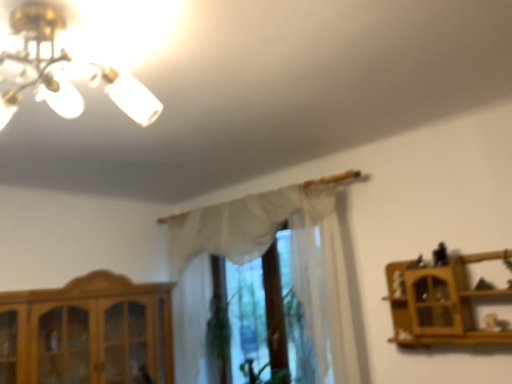
The image size is (512, 384). What do you see at coordinates (243, 224) in the screenshot?
I see `white sheer curtain at center` at bounding box center [243, 224].

The height and width of the screenshot is (384, 512). I want to click on wooden shelf at right, so [440, 302].

Does black plastic toy at upper right have a greater width compared to white sheer curtain at center?

Incorrect, the width of black plastic toy at upper right does not surpass that of white sheer curtain at center.

Considering the relative sizes of black plastic toy at upper right and white sheer curtain at center in the image provided, is black plastic toy at upper right shorter than white sheer curtain at center?

Correct, black plastic toy at upper right is not as tall as white sheer curtain at center.

From a real-world perspective, is black plastic toy at upper right under white sheer curtain at center?

Correct, in the physical world, black plastic toy at upper right is lower than white sheer curtain at center.

Where is `shelf that appears on the right of black plastic toy at upper right`? The height and width of the screenshot is (384, 512). shelf that appears on the right of black plastic toy at upper right is located at coordinates (440, 302).

In the scene shown: How distant is wooden shelf at right from black plastic toy at upper right?

The distance of wooden shelf at right from black plastic toy at upper right is 9.78 inches.

From the image's perspective, is wooden shelf at right located beneath black plastic toy at upper right?

Yes, from the image's perspective, wooden shelf at right is beneath black plastic toy at upper right.

Is wooden shelf at right oriented towards black plastic toy at upper right?

No.

From a real-world perspective, is wooden cabinet at lower left positioned above or below white sheer curtain at center?

From a real-world perspective, wooden cabinet at lower left is physically below white sheer curtain at center.

In the image, is wooden cabinet at lower left on the left side or the right side of white sheer curtain at center?

wooden cabinet at lower left is positioned on white sheer curtain at center's left side.

Are wooden cabinet at lower left and white sheer curtain at center located far from each other?

No, wooden cabinet at lower left is in close proximity to white sheer curtain at center.

Could you tell me if wooden cabinet at lower left is facing white sheer curtain at center?

Yes, wooden cabinet at lower left is turned towards white sheer curtain at center.

You are a GUI agent. You are given a task and a screenshot of the screen. Output one action in this format:
    pyautogui.click(x=<x>, y=<y>)
    Task: Click on the curtain that appears below the black plastic toy at upper right (from the image's perspective)
    The image size is (512, 384).
    Given the screenshot: What is the action you would take?
    pyautogui.click(x=243, y=224)

Considering the sizes of white sheer curtain at center and black plastic toy at upper right in the image, is white sheer curtain at center wider or thinner than black plastic toy at upper right?

Considering their sizes, white sheer curtain at center looks broader than black plastic toy at upper right.

Between white sheer curtain at center and black plastic toy at upper right, which one has less height?

With less height is black plastic toy at upper right.

Does white sheer curtain at center appear on the left side of black plastic toy at upper right?

Yes, white sheer curtain at center is to the left of black plastic toy at upper right.

Is wooden shelf at right aimed at wooden cabinet at lower left?

No, wooden shelf at right does not turn towards wooden cabinet at lower left.

From the image's perspective, is wooden shelf at right above wooden cabinet at lower left?

Yes, from the image's perspective, wooden shelf at right is on top of wooden cabinet at lower left.

Between wooden shelf at right and wooden cabinet at lower left, which one has smaller size?

With smaller size is wooden shelf at right.

Can you confirm if wooden shelf at right is positioned to the right of wooden cabinet at lower left?

Correct, you'll find wooden shelf at right to the right of wooden cabinet at lower left.

Is black plastic toy at upper right completely or partially outside of wooden shelf at right?

No, black plastic toy at upper right is not entirely external to wooden shelf at right.

Which of these two, black plastic toy at upper right or wooden shelf at right, stands taller?

Standing taller between the two is wooden shelf at right.

From the image's perspective, is black plastic toy at upper right above or below wooden shelf at right?

black plastic toy at upper right is above wooden shelf at right.

Which object is closer to the camera taking this photo, black plastic toy at upper right or wooden shelf at right?

wooden shelf at right is closer to the camera.

How much distance is there between white sheer curtain at center and wooden cabinet at lower left?

The distance of white sheer curtain at center from wooden cabinet at lower left is 32.98 inches.

Is wooden cabinet at lower left surrounded by white sheer curtain at center?

Definitely not — wooden cabinet at lower left is not inside white sheer curtain at center.

Based on the photo, from the image's perspective, is white sheer curtain at center below wooden cabinet at lower left?

No, from the image's perspective, white sheer curtain at center is not below wooden cabinet at lower left.

Looking at this image, which object is thinner, white sheer curtain at center or wooden cabinet at lower left?

white sheer curtain at center.

Image resolution: width=512 pixels, height=384 pixels. I want to click on toy that appears above the white sheer curtain at center (from the image's perspective), so click(x=440, y=255).

At what (x,y) coordinates should I click in order to perform the action: click on shelf located in front of the black plastic toy at upper right. Please return your answer as a coordinate pair (x, y). The width and height of the screenshot is (512, 384). Looking at the image, I should click on (440, 302).

When comparing their distances from wooden shelf at right, does wooden cabinet at lower left or black plastic toy at upper right seem further?

Based on the image, wooden cabinet at lower left appears to be further to wooden shelf at right.

Which object lies further to the anchor point white sheer curtain at center, wooden cabinet at lower left or wooden shelf at right?

The object further to white sheer curtain at center is wooden shelf at right.

When comparing their distances from wooden cabinet at lower left, does white sheer curtain at center or black plastic toy at upper right seem closer?

white sheer curtain at center.

When comparing their distances from wooden cabinet at lower left, does black plastic toy at upper right or white sheer curtain at center seem closer?

Among the two, white sheer curtain at center is located nearer to wooden cabinet at lower left.

When comparing their distances from black plastic toy at upper right, does wooden shelf at right or white sheer curtain at center seem closer?

Based on the image, wooden shelf at right appears to be nearer to black plastic toy at upper right.

Which object lies further to the anchor point black plastic toy at upper right, wooden shelf at right or wooden cabinet at lower left?

wooden cabinet at lower left.

From the image, which object appears to be farther from white sheer curtain at center, black plastic toy at upper right or wooden cabinet at lower left?

Based on the image, black plastic toy at upper right appears to be further to white sheer curtain at center.

Considering their positions, is black plastic toy at upper right positioned closer to wooden shelf at right than wooden cabinet at lower left?

black plastic toy at upper right is positioned closer to the anchor wooden shelf at right.

The width and height of the screenshot is (512, 384). I want to click on toy between white sheer curtain at center and wooden shelf at right, so click(440, 255).

The height and width of the screenshot is (384, 512). In order to click on curtain between wooden cabinet at lower left and black plastic toy at upper right from left to right in this screenshot , I will do `click(243, 224)`.

Locate an element on the screen. This screenshot has height=384, width=512. toy situated between wooden cabinet at lower left and wooden shelf at right from left to right is located at coordinates (440, 255).

Where is `curtain situated between wooden cabinet at lower left and wooden shelf at right from left to right`? The height and width of the screenshot is (384, 512). curtain situated between wooden cabinet at lower left and wooden shelf at right from left to right is located at coordinates (243, 224).